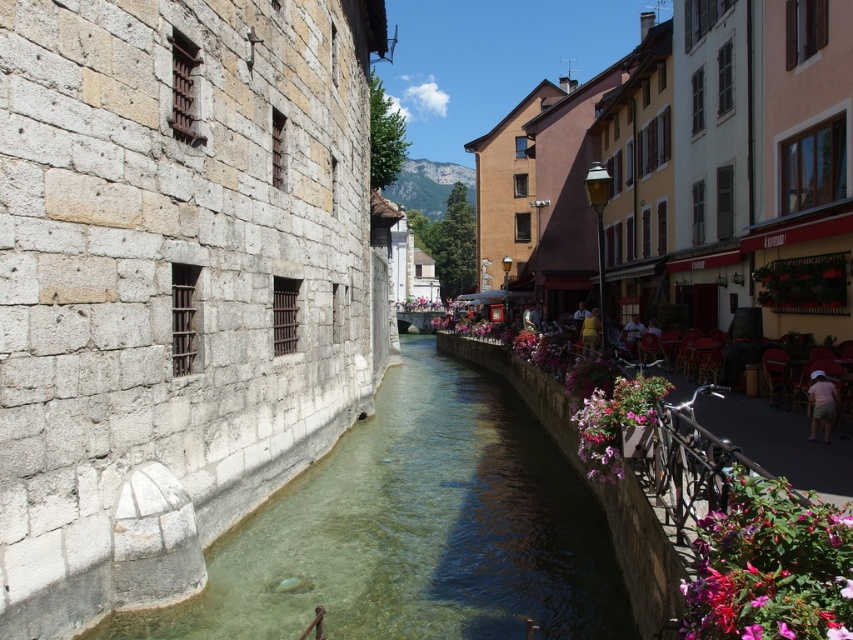
Between point (727, 570) and point (589, 349), which one is positioned behind?

Point (589, 349)

Which of these two, pink matte flowers at lower right or yellow fabric person at center, stands shorter?

With less height is pink matte flowers at lower right.

The height and width of the screenshot is (640, 853). In order to click on pink matte flowers at lower right in this screenshot , I will do coord(770,566).

Who is higher up, clear stone stream at center or pink matte flowers at lower right?

pink matte flowers at lower right

Which is behind, point (306, 550) or point (708, 604)?

The point (306, 550) is more distant.

Find the location of `clear stone stream at center`. clear stone stream at center is located at coordinates (415, 531).

Is point (746, 500) positioned behind point (595, 410)?

No.

Does pink matte flowers at lower right lie behind pink fabric flowers at right?

No, pink matte flowers at lower right is in front of pink fabric flowers at right.

The image size is (853, 640). In order to click on pink matte flowers at lower right in this screenshot , I will do coord(770,566).

You are a GUI agent. You are given a task and a screenshot of the screen. Output one action in this format:
    pyautogui.click(x=<x>, y=<y>)
    Task: Click on the pink matte flowers at lower right
    This screenshot has height=640, width=853.
    Given the screenshot: What is the action you would take?
    pyautogui.click(x=770, y=566)